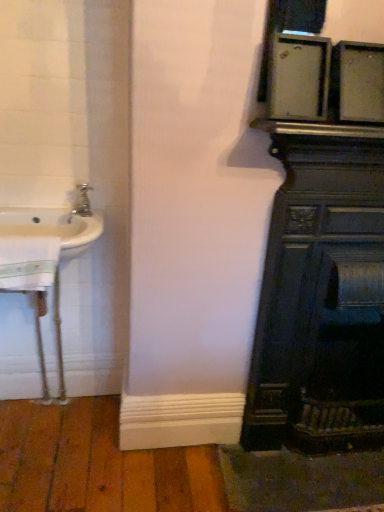
Identify the location of space that is in front of brushed metal faucet at left. This screenshot has height=512, width=384. (63, 226).